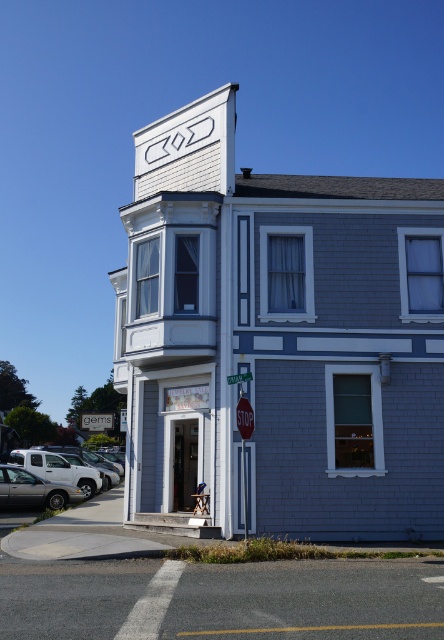
Question: Is silver metallic sedan at lower left further to camera compared to red matte stop sign at center?

Choices:
 (A) no
 (B) yes

Answer: (B)

Question: Does silver metallic sedan at lower left have a smaller size compared to red matte stop sign at center?

Choices:
 (A) no
 (B) yes

Answer: (A)

Question: Where is gray brick building at center located in relation to red matte stop sign at center in the image?

Choices:
 (A) left
 (B) right

Answer: (B)

Question: Which object is closer to the camera taking this photo?

Choices:
 (A) silver metallic truck at lower left
 (B) silver metallic sedan at lower left

Answer: (B)

Question: Considering the real-world distances, which object is closest to the silver metallic truck at lower left?

Choices:
 (A) silver metallic sedan at lower left
 (B) gray brick building at center

Answer: (A)

Question: Among these points, which one is nearest to the camera?

Choices:
 (A) (10, 451)
 (B) (241, 426)
 (C) (18, 472)

Answer: (B)